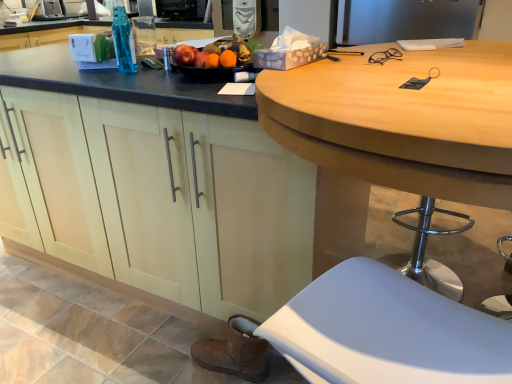
Question: Considering the relative sizes of wooden desk at center and translucent plastic bottle at upper center in the image provided, is wooden desk at center taller than translucent plastic bottle at upper center?

Choices:
 (A) yes
 (B) no

Answer: (A)

Question: Does wooden desk at center have a larger size compared to translucent plastic bottle at upper center?

Choices:
 (A) no
 (B) yes

Answer: (B)

Question: Can you confirm if wooden desk at center is shorter than translucent plastic bottle at upper center?

Choices:
 (A) no
 (B) yes

Answer: (A)

Question: Is wooden desk at center positioned with its back to translucent plastic bottle at upper center?

Choices:
 (A) no
 (B) yes

Answer: (B)

Question: Could translucent plastic bottle at upper center be considered to be inside wooden desk at center?

Choices:
 (A) no
 (B) yes

Answer: (A)

Question: From the image's perspective, would you say wooden desk at center is positioned over translucent plastic bottle at upper center?

Choices:
 (A) no
 (B) yes

Answer: (A)

Question: Is matte wood cabinets at center facing towards brown suede boot at lower left?

Choices:
 (A) yes
 (B) no

Answer: (A)

Question: Considering the relative positions of matte wood cabinets at center and brown suede boot at lower left in the image provided, is matte wood cabinets at center to the right of brown suede boot at lower left from the viewer's perspective?

Choices:
 (A) no
 (B) yes

Answer: (A)

Question: Can we say matte wood cabinets at center lies outside brown suede boot at lower left?

Choices:
 (A) no
 (B) yes

Answer: (B)

Question: Can you confirm if matte wood cabinets at center is taller than brown suede boot at lower left?

Choices:
 (A) no
 (B) yes

Answer: (B)

Question: Is matte wood cabinets at center with brown suede boot at lower left?

Choices:
 (A) no
 (B) yes

Answer: (A)

Question: Considering the relative positions of matte wood cabinets at center and brown suede boot at lower left in the image provided, is matte wood cabinets at center in front of brown suede boot at lower left?

Choices:
 (A) no
 (B) yes

Answer: (B)

Question: Is wooden desk at center located outside brushed metal sink at upper left?

Choices:
 (A) no
 (B) yes

Answer: (B)